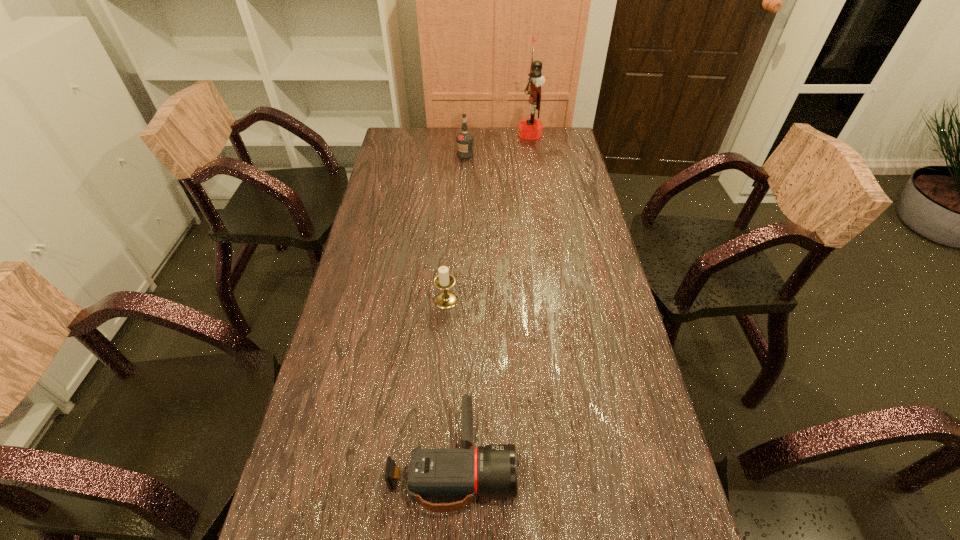
Find the location of a particular element. free location at the far left corner of the desktop is located at coordinates (394, 144).

Where is `vacant space that's between the rightmost object and the nearest object`? This screenshot has height=540, width=960. vacant space that's between the rightmost object and the nearest object is located at coordinates (492, 298).

In order to click on free point between the second tallest object and the second nearest object in this screenshot , I will do `click(456, 227)`.

Image resolution: width=960 pixels, height=540 pixels. Identify the location of free space between the nutcracker and the second nearest object. (488, 217).

Identify the location of vacant area between the second tallest object and the second shortest object. This screenshot has height=540, width=960. click(456, 227).

The height and width of the screenshot is (540, 960). Identify the location of free spot between the third nearest object and the tallest object. (497, 144).

Locate an element on the screen. vacant region between the third nearest object and the camcorder is located at coordinates (459, 308).

Where is `free spot between the second nearest object and the tallest object`? Image resolution: width=960 pixels, height=540 pixels. free spot between the second nearest object and the tallest object is located at coordinates (488, 217).

You are a GUI agent. You are given a task and a screenshot of the screen. Output one action in this format:
    pyautogui.click(x=<x>, y=<y>)
    Task: Click on the vacant area that lies between the farthest object and the third nearest object
    This screenshot has width=960, height=540.
    Given the screenshot: What is the action you would take?
    pyautogui.click(x=497, y=144)

The height and width of the screenshot is (540, 960). What are the coordinates of `vacant space in between the nutcracker and the vodka` in the screenshot? It's located at coord(497,144).